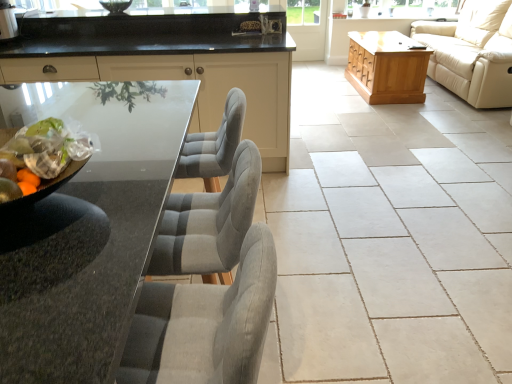
Describe the element at coordinates (307, 28) in the screenshot. I see `transparent glass screen door at center` at that location.

Describe the element at coordinates (387, 67) in the screenshot. The width and height of the screenshot is (512, 384). I see `light brown wooden chest at right` at that location.

What do you see at coordinates (389, 239) in the screenshot? Image resolution: width=512 pixels, height=384 pixels. I see `beige ceramic tile at center` at bounding box center [389, 239].

Identify the location of metallic silver toaster at upper left. This screenshot has height=384, width=512. (7, 21).

Identify the location of matte black cabinetry at center. (200, 85).

Which point is more distant from viewer, [419,51] or [54,163]?

Point [419,51]

Is light brown wooden chest at right completely or partially outside of translucent plastic bag of mixed fruits at left?

Yes.

Is light brown wooden chest at right shorter than translucent plastic bag of mixed fruits at left?

No, light brown wooden chest at right is not shorter than translucent plastic bag of mixed fruits at left.

Is light brown wooden chest at right positioned with its back to translucent plastic bag of mixed fruits at left?

No, translucent plastic bag of mixed fruits at left is not at the back of light brown wooden chest at right.

Considering the relative sizes of light brown wooden chest at right and beige leather couch at right in the image provided, is light brown wooden chest at right wider than beige leather couch at right?

In fact, light brown wooden chest at right might be narrower than beige leather couch at right.

Does point (380, 68) come closer to viewer compared to point (488, 71)?

No.

Is light brown wooden chest at right situated inside beige leather couch at right or outside?

light brown wooden chest at right lies outside beige leather couch at right.

Considering the positions of point (169, 75) and point (76, 137), is point (169, 75) closer or farther from the camera than point (76, 137)?

Clearly, point (169, 75) is more distant from the camera than point (76, 137).

Would you say matte black cabinetry at center is inside or outside translucent plastic bag of mixed fruits at left?

matte black cabinetry at center is located beyond the bounds of translucent plastic bag of mixed fruits at left.

Can you tell me how much matte black cabinetry at center and translucent plastic bag of mixed fruits at left differ in facing direction?

They differ by 110 degrees in their facing directions.

Would you consider matte black cabinetry at center to be distant from translucent plastic bag of mixed fruits at left?

matte black cabinetry at center is positioned a significant distance from translucent plastic bag of mixed fruits at left.

Consider the image. Which of these two, matte black cabinetry at center or light brown wooden chest at right, stands shorter?

Standing shorter between the two is light brown wooden chest at right.

From a real-world perspective, is matte black cabinetry at center physically above light brown wooden chest at right?

Yes, from a real-world perspective, matte black cabinetry at center is over light brown wooden chest at right

Is matte black cabinetry at center closer to camera compared to light brown wooden chest at right?

Yes, it is in front of light brown wooden chest at right.

Which point is more distant from viewer, [24,75] or [377,64]?

Positioned behind is point [377,64].

Is transparent glass screen door at center positioned with its back to beige leather couch at right?

No.

The image size is (512, 384). I want to click on studio couch in front of the transparent glass screen door at center, so click(x=473, y=52).

From the image's perspective, is transparent glass screen door at center under beige leather couch at right?

No.

Is transparent glass screen door at center taller than beige leather couch at right?

In fact, transparent glass screen door at center may be shorter than beige leather couch at right.

What are the coordinates of `studio couch above the metallic silver toaster at upper left (from the image's perspective)` in the screenshot? It's located at (473, 52).

Is beige leather couch at right to the left of metallic silver toaster at upper left from the viewer's perspective?

Incorrect, beige leather couch at right is not on the left side of metallic silver toaster at upper left.

Would you say beige leather couch at right contains metallic silver toaster at upper left?

No, metallic silver toaster at upper left is located outside of beige leather couch at right.

From a real-world perspective, is metallic silver toaster at upper left located beneath light brown wooden chest at right?

No, from a real-world perspective, metallic silver toaster at upper left is not beneath light brown wooden chest at right.

Is metallic silver toaster at upper left at the right side of light brown wooden chest at right?

No, metallic silver toaster at upper left is not to the right of light brown wooden chest at right.

You are a GUI agent. You are given a task and a screenshot of the screen. Output one action in this format:
    pyautogui.click(x=<x>, y=<y>)
    Task: Click on the table that appears above the metallic silver toaster at upper left (from the image's perspective)
    
    Given the screenshot: What is the action you would take?
    pyautogui.click(x=387, y=67)

I want to click on food above the light brown wooden chest at right (from a real-world perspective), so click(x=44, y=153).

Locate an element on the screen. This screenshot has height=384, width=512. table located below the beige leather couch at right (from the image's perspective) is located at coordinates (387, 67).

From the image, which object appears to be nearer to beige leather couch at right, beige ceramic tile at center or transparent glass screen door at center?

Among the two, transparent glass screen door at center is located nearer to beige leather couch at right.

From the image, which object appears to be farther from transparent glass screen door at center, matte black cabinetry at center or translucent plastic bag of mixed fruits at left?

Based on the image, translucent plastic bag of mixed fruits at left appears to be further to transparent glass screen door at center.

Which object lies further to the anchor point light brown wooden chest at right, beige leather couch at right or matte black cabinetry at center?

Based on the image, matte black cabinetry at center appears to be further to light brown wooden chest at right.

Considering their positions, is translucent plastic bag of mixed fruits at left positioned further to beige leather couch at right than transparent glass screen door at center?

translucent plastic bag of mixed fruits at left lies further to beige leather couch at right than the other object.

Considering their positions, is metallic silver toaster at upper left positioned closer to light brown wooden chest at right than translucent plastic bag of mixed fruits at left?

metallic silver toaster at upper left lies closer to light brown wooden chest at right than the other object.

When comparing their distances from beige leather couch at right, does metallic silver toaster at upper left or translucent plastic bag of mixed fruits at left seem further?

The object further to beige leather couch at right is translucent plastic bag of mixed fruits at left.

Which object lies further to the anchor point translucent plastic bag of mixed fruits at left, beige ceramic tile at center or light brown wooden chest at right?

The object further to translucent plastic bag of mixed fruits at left is light brown wooden chest at right.

Based on the photo, considering their positions, is beige ceramic tile at center positioned closer to translucent plastic bag of mixed fruits at left than metallic silver toaster at upper left?

beige ceramic tile at center is closer to translucent plastic bag of mixed fruits at left.

I want to click on studio couch located between translucent plastic bag of mixed fruits at left and light brown wooden chest at right in the depth direction, so (x=473, y=52).

Image resolution: width=512 pixels, height=384 pixels. I want to click on food between metallic silver toaster at upper left and beige leather couch at right in the horizontal direction, so click(x=44, y=153).

Identify the location of appliance between beige ceramic tile at center and transparent glass screen door at center in the front-back direction. (7, 21).

Image resolution: width=512 pixels, height=384 pixels. In order to click on screen door between metallic silver toaster at upper left and light brown wooden chest at right in the horizontal direction in this screenshot , I will do `click(307, 28)`.